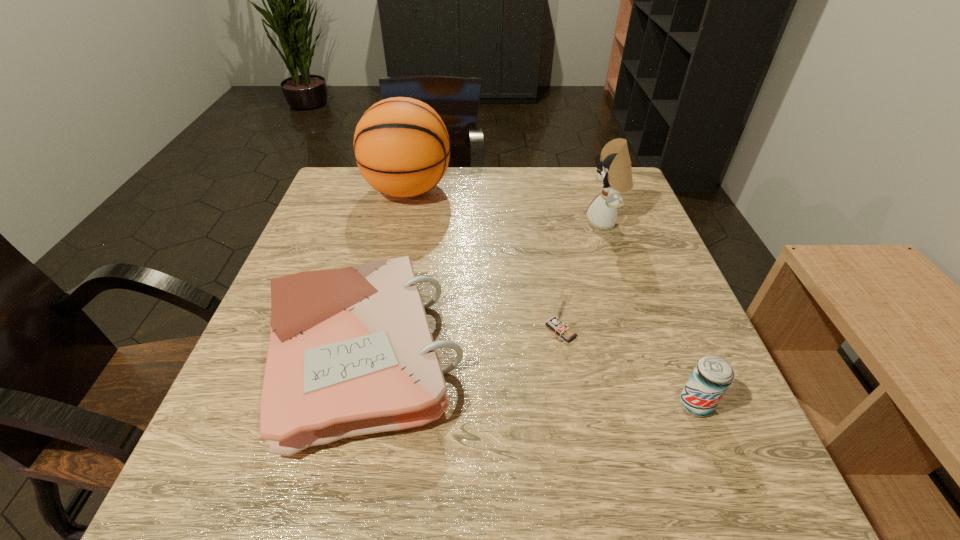
At what (x,y) coordinates should I click in order to perform the action: click on object that is positioned at the near left corner. Please return your answer as a coordinate pair (x, y). The image size is (960, 540). Looking at the image, I should click on (351, 352).

I want to click on object that is at the far right corner, so click(x=614, y=169).

Find the location of `vacant region at the far edge of the desktop`. vacant region at the far edge of the desktop is located at coordinates (539, 202).

Image resolution: width=960 pixels, height=540 pixels. In the image, there is a desktop. Find the location of `free space at the near edge`. free space at the near edge is located at coordinates (581, 455).

What are the coordinates of `free location at the left edge` in the screenshot? It's located at (302, 267).

Locate an element on the screen. The height and width of the screenshot is (540, 960). free location at the right edge of the desktop is located at coordinates (631, 350).

In the image, there is a desktop. At what (x,y) coordinates should I click in order to perform the action: click on free space at the far left corner. Please return your answer as a coordinate pair (x, y). Looking at the image, I should click on (339, 179).

Where is `blank space at the near left corner of the desktop`? This screenshot has height=540, width=960. blank space at the near left corner of the desktop is located at coordinates (288, 473).

The height and width of the screenshot is (540, 960). I want to click on free space at the near right corner of the desktop, so click(x=666, y=477).

Find the location of `vacant area that lies between the doll and the third object from right to left`. vacant area that lies between the doll and the third object from right to left is located at coordinates (583, 276).